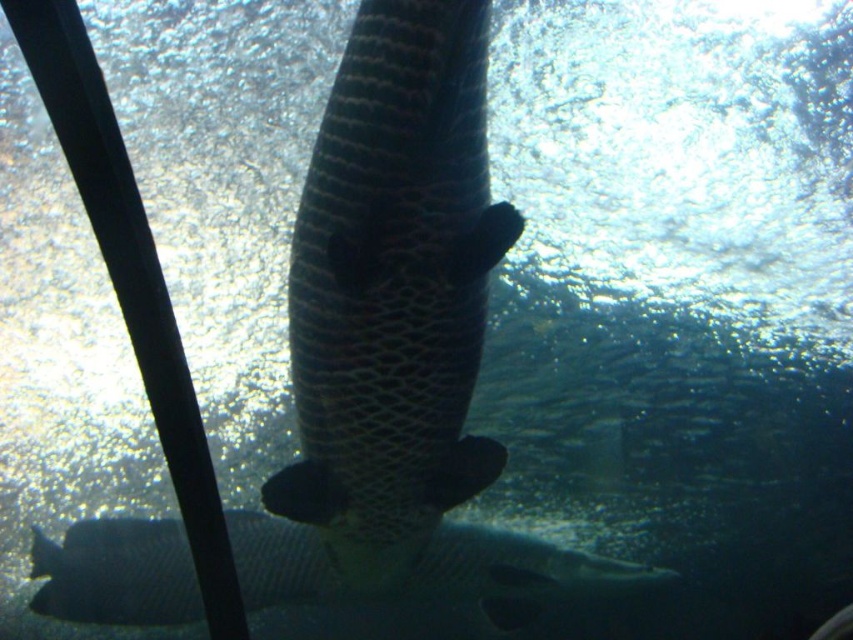
Question: Considering the relative positions of dark textured fish at center and dark gray textured fish at lower center in the image provided, where is dark textured fish at center located with respect to dark gray textured fish at lower center?

Choices:
 (A) left
 (B) right

Answer: (A)

Question: In this image, where is dark textured fish at center located relative to dark gray textured fish at lower center?

Choices:
 (A) below
 (B) above

Answer: (B)

Question: Is dark textured fish at center positioned in front of dark gray textured fish at lower center?

Choices:
 (A) no
 (B) yes

Answer: (B)